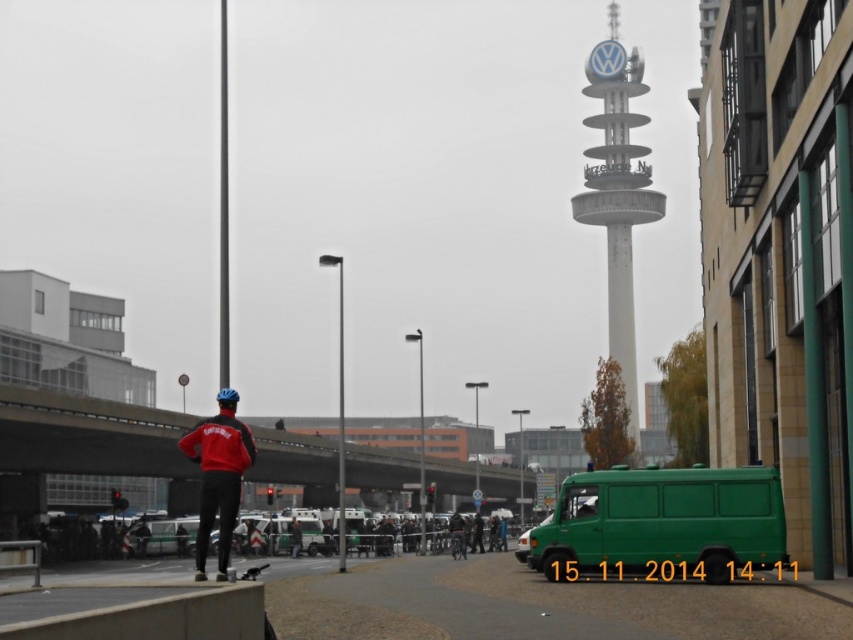
Who is more forward, (x=387, y=451) or (x=189, y=445)?

Point (x=189, y=445) is in front.

Does concrete bridge at center have a greater height compared to red matte jacket at lower left?

Yes, concrete bridge at center is taller than red matte jacket at lower left.

Is point (38, 452) behind point (196, 541)?

Yes.

This screenshot has width=853, height=640. I want to click on concrete bridge at center, so click(88, 435).

Describe the element at coordinates (218, 476) in the screenshot. I see `red matte jacket at lower left` at that location.

Who is more forward, (x=230, y=490) or (x=299, y=534)?

Point (x=230, y=490)

Between point (193, 461) and point (299, 545), which one is positioned in front?

Point (193, 461) is in front.

The image size is (853, 640). I want to click on red matte jacket at lower left, so click(218, 476).

Who is positioned more to the right, green matte van at lower right or white smooth tower at center?

white smooth tower at center

Who is more distant from viewer, (746, 545) or (610, 260)?

The point (610, 260) is behind.

Is point (604, 515) behind point (630, 214)?

No, it is in front of (630, 214).

Locate an element on the screen. The image size is (853, 640). green matte van at lower right is located at coordinates pyautogui.click(x=663, y=522).